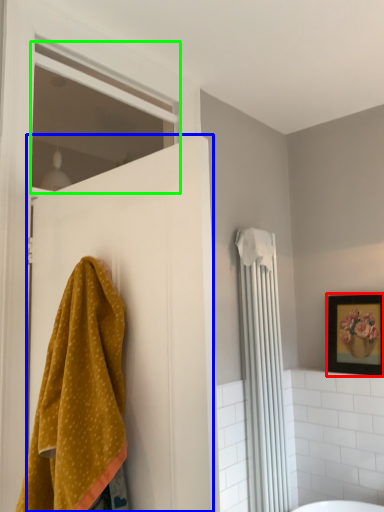
Question: Estimate the real-world distances between objects in this image. Which object is farther from picture frame (highlighted by a red box), door (highlighted by a blue box) or window (highlighted by a green box)?

Choices:
 (A) door
 (B) window

Answer: (B)